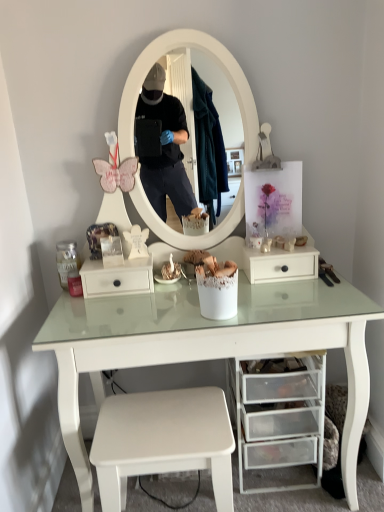
I want to click on free space above white matte drawer at center, the 2th drawer from the right (from a real-world perspective), so click(x=118, y=260).